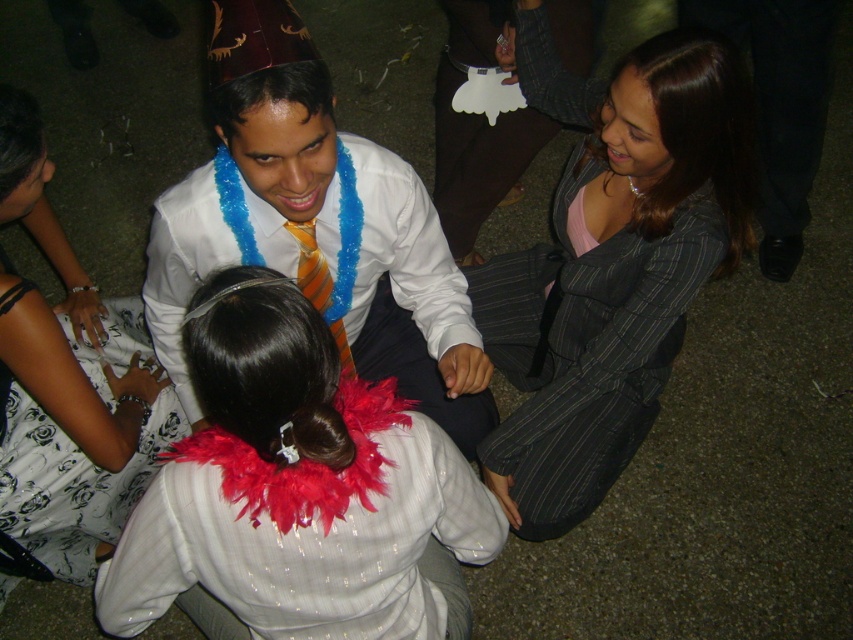
You are a photographer trying to capture a group photo of the white satin shirt at center and the white floral dress at lower left. Which one should you focus on first if you want to ensure both are in frame and properly exposed?

The white satin shirt at center is shorter than the white floral dress at lower left, so you should focus on the white floral dress at lower left first to ensure proper exposure for the taller subject.

You are a photographer trying to capture a group photo of the people in the scene. The camera you are using has a minimum focus distance of 14 inches. Can you focus on both the white satin shirt at center and the white floral dress at lower left without moving the camera?

The white satin shirt at center and white floral dress at lower left are 13.82 inches apart. Since the distance between them is less than the camera minimum focus distance of 14 inches, the camera can focus on both objects without moving.